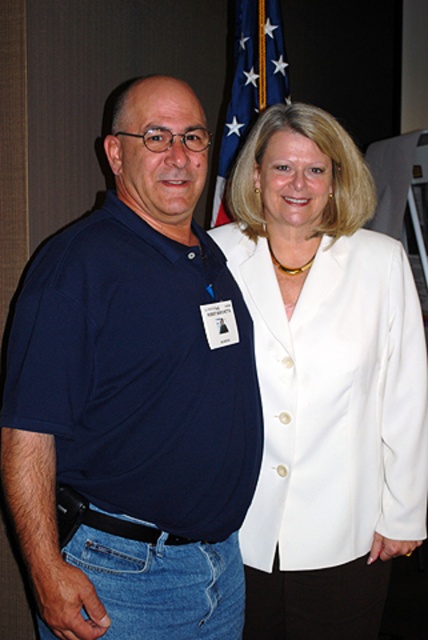
Question: Which of the following is the farthest from the observer?

Choices:
 (A) matte blue shirt at center
 (B) white matte blazer at center
 (C) blue fabric flag at upper center

Answer: (C)

Question: Is matte blue shirt at center bigger than white matte blazer at center?

Choices:
 (A) no
 (B) yes

Answer: (B)

Question: Which point appears farthest from the camera in this image?

Choices:
 (A) (264, 32)
 (B) (246, 557)

Answer: (A)

Question: Can you confirm if matte blue shirt at center is wider than white matte blazer at center?

Choices:
 (A) no
 (B) yes

Answer: (A)

Question: Is white matte blazer at center above blue fabric flag at upper center?

Choices:
 (A) yes
 (B) no

Answer: (B)

Question: Among these objects, which one is farthest from the camera?

Choices:
 (A) white matte blazer at center
 (B) blue fabric flag at upper center
 (C) matte blue shirt at center

Answer: (B)